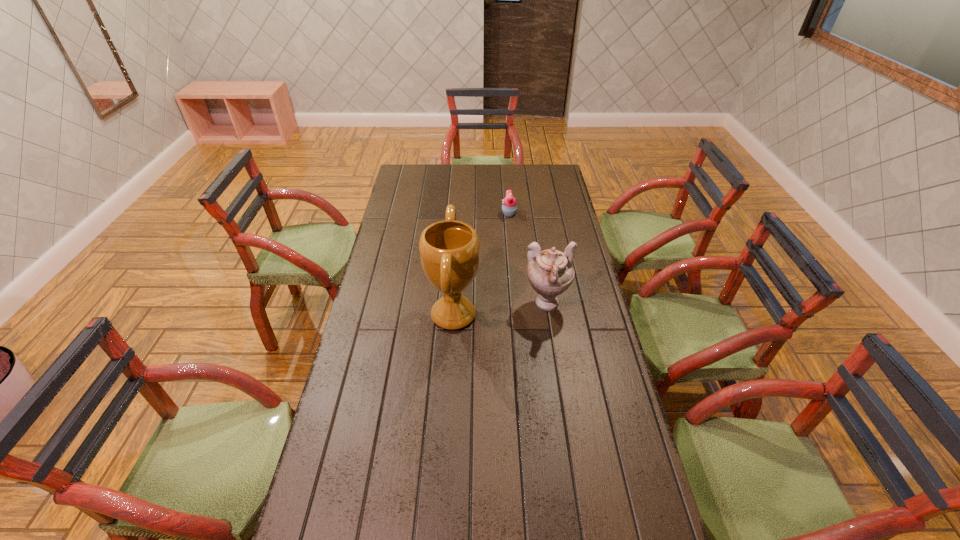
Select which object is the closest to the cupcake. Please provide its 2D coordinates. Your answer should be formatted as a tuple, i.e. [(x, y)], where the tuple contains the x and y coordinates of a point satisfying the conditions above.

[(449, 250)]

Find the location of a particular element. Image resolution: width=960 pixels, height=540 pixels. free space that satisfies the following two spatial constraints: 1. on the face of the urn; 2. on the right side of the shortest object is located at coordinates (517, 305).

Identify the location of free space that satisfies the following two spatial constraints: 1. on the back side of the urn; 2. on the face of the cupcake. (533, 213).

At what (x,y) coordinates should I click in order to perform the action: click on blank area in the image that satisfies the following two spatial constraints: 1. on the face of the second shortest object; 2. on the right side of the shortest object. Please return your answer as a coordinate pair (x, y). The width and height of the screenshot is (960, 540). Looking at the image, I should click on (517, 305).